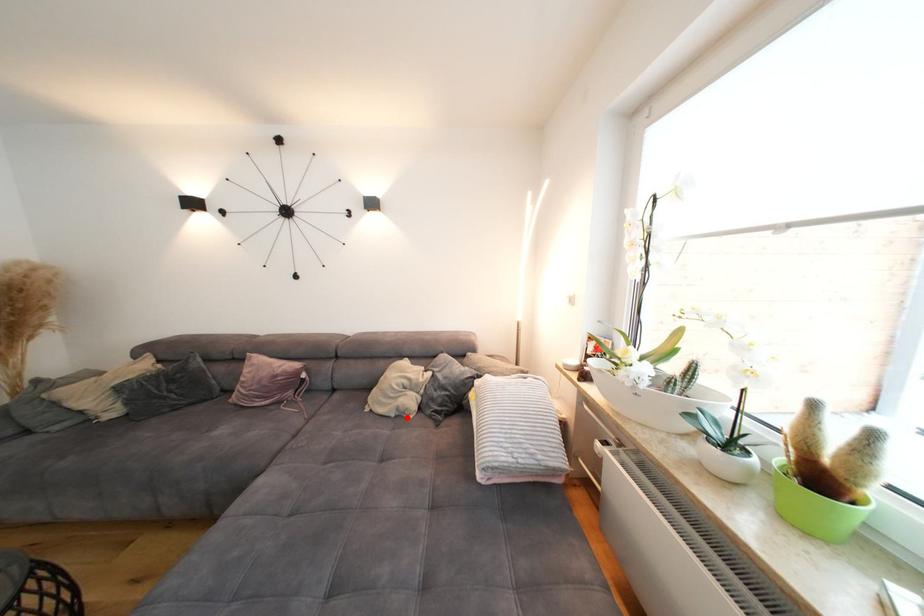
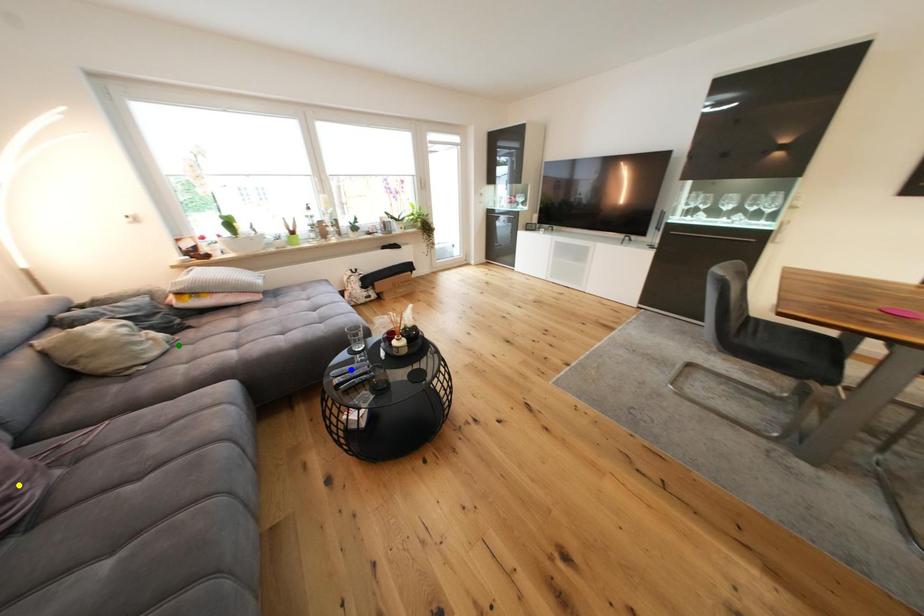
Question: I am providing you with two images of the same scene from different viewpoints. A red point is marked on the first image. You are given multiple points on the second image. In image 2, which mark is for the same physical point as the one in image 1?

Choices:
 (A) yellow point
 (B) blue point
 (C) green point

Answer: (C)